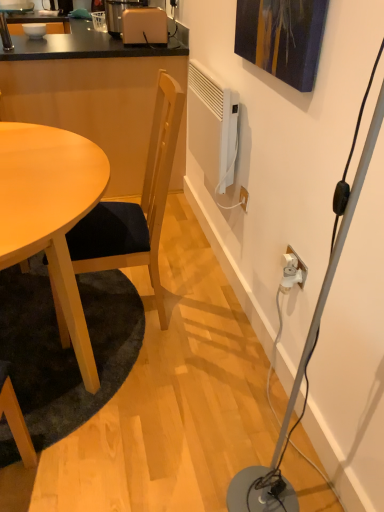
Where is `vacant area on top of light wood table at left (from a real-world perspective)`? The width and height of the screenshot is (384, 512). vacant area on top of light wood table at left (from a real-world perspective) is located at coordinates (44, 162).